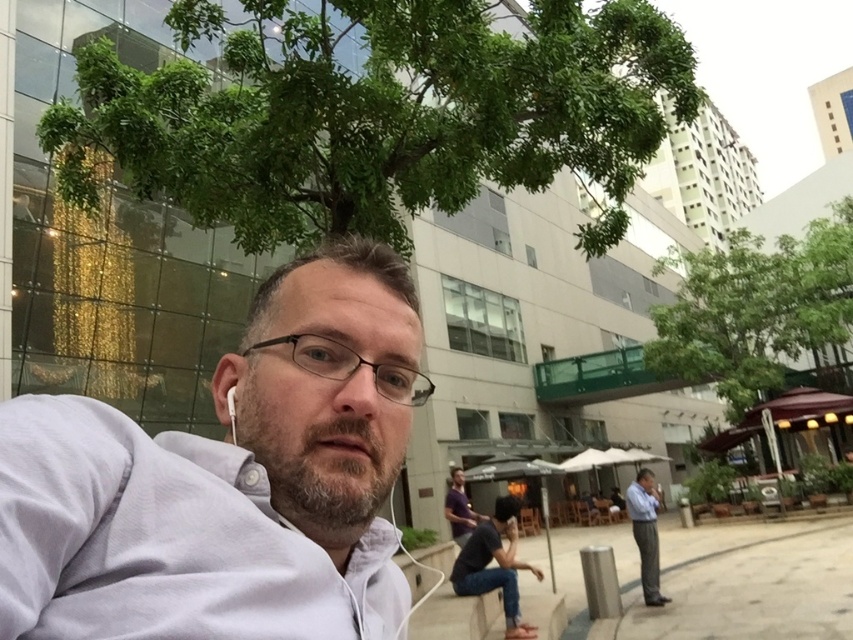
You are standing at the center of the scene and want to walk to the light blue shirt at right. There is a green leafy tree at upper right in the way. Is the tree blocking your path? Please explain why or why not.

The green leafy tree at upper right and light blue shirt at right are 6.59 meters apart. Since the tree is at the upper right and the shirt is at the right, they are positioned apart horizontally. The tree is not directly in the path between the center and the shirt, so it is not blocking the way.